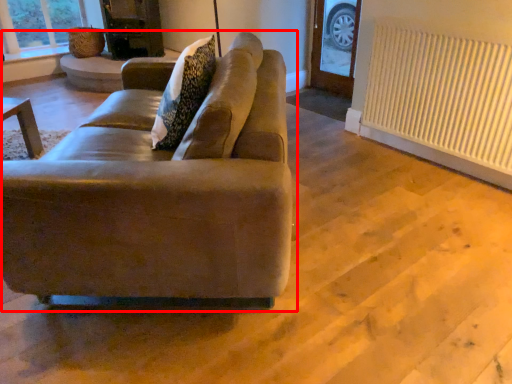
Question: Where is studio couch (annotated by the red box) located in relation to radiator in the image?

Choices:
 (A) left
 (B) right

Answer: (A)